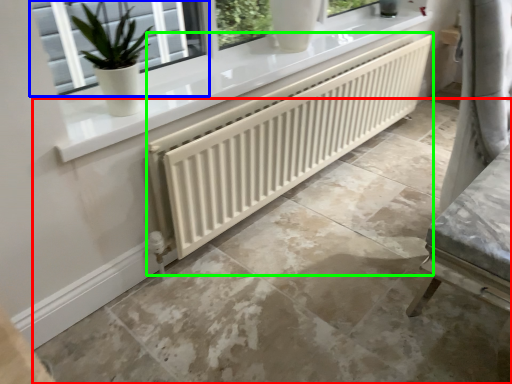
Question: Estimate the real-world distances between objects in this image. Which object is farther from concrete (highlighted by a red box), window (highlighted by a blue box) or radiator (highlighted by a green box)?

Choices:
 (A) window
 (B) radiator

Answer: (A)